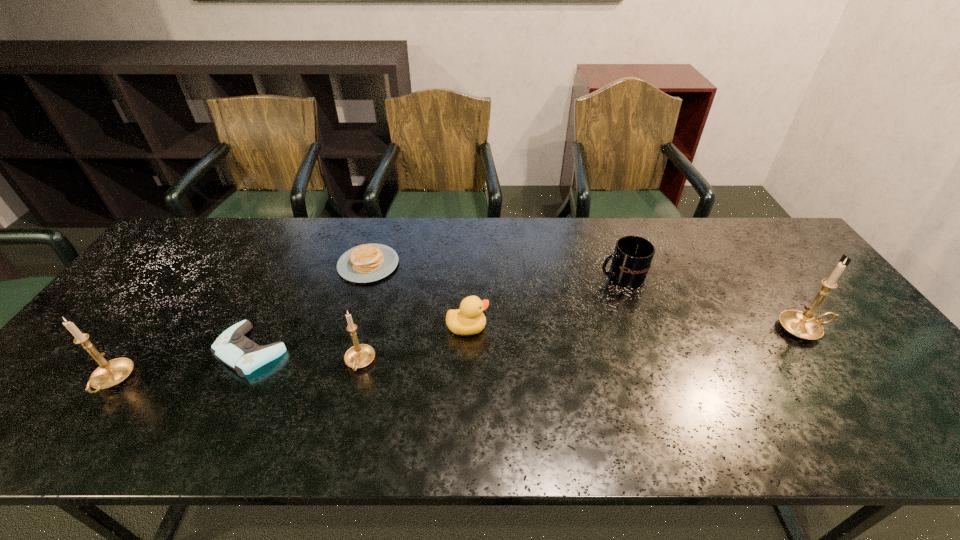
This screenshot has width=960, height=540. What are the coordinates of `the second shortest candle holder` in the screenshot? It's located at click(x=110, y=373).

This screenshot has width=960, height=540. What are the coordinates of `the leftmost candle holder` in the screenshot? It's located at (110, 373).

At what (x,y) coordinates should I click in order to perform the action: click on the second candle holder from right to left. Please return your answer as a coordinate pair (x, y). Looking at the image, I should click on (360, 355).

This screenshot has height=540, width=960. What are the coordinates of `the shortest candle holder` in the screenshot? It's located at (360, 355).

Locate an element on the screen. Image resolution: width=960 pixels, height=540 pixels. the rightmost candle holder is located at coordinates (803, 325).

I want to click on the rightmost object, so click(x=803, y=325).

Identify the location of mug. click(x=631, y=261).

The height and width of the screenshot is (540, 960). I want to click on duck, so click(468, 320).

Where is `pancake`? This screenshot has width=960, height=540. pancake is located at coordinates (364, 263).

Find the location of a particular element. control is located at coordinates (234, 349).